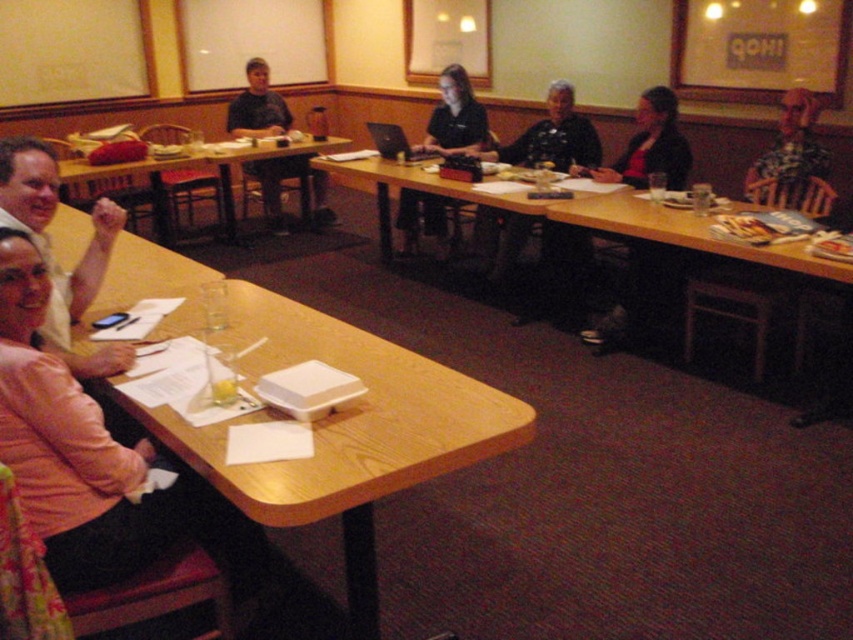
Is point (784, 128) closer to camera compared to point (247, 109)?

Yes.

Is checkered shirt at upper right positioned in front of matte black shirt at upper center?

Yes, checkered shirt at upper right is in front of matte black shirt at upper center.

Between point (792, 112) and point (258, 68), which one is positioned in front?

Positioned in front is point (792, 112).

The image size is (853, 640). I want to click on checkered shirt at upper right, so click(788, 154).

Who is positioned more to the left, pink fabric jacket at lower left or matte black shirt at upper center?

From the viewer's perspective, matte black shirt at upper center appears more on the left side.

Can you confirm if pink fabric jacket at lower left is positioned to the left of matte black shirt at upper center?

No, pink fabric jacket at lower left is not to the left of matte black shirt at upper center.

Which is behind, point (25, 202) or point (241, 106)?

Positioned behind is point (241, 106).

This screenshot has height=640, width=853. In order to click on pink fabric jacket at lower left in this screenshot , I will do `click(51, 253)`.

Which of these two, dark gray sweater at center or black matte laptop at center, stands shorter?

black matte laptop at center is shorter.

Which is below, dark gray sweater at center or black matte laptop at center?

Positioned lower is dark gray sweater at center.

This screenshot has width=853, height=640. What do you see at coordinates (648, 147) in the screenshot? I see `dark gray sweater at center` at bounding box center [648, 147].

Locate an element on the screen. The image size is (853, 640). dark gray sweater at center is located at coordinates point(648,147).